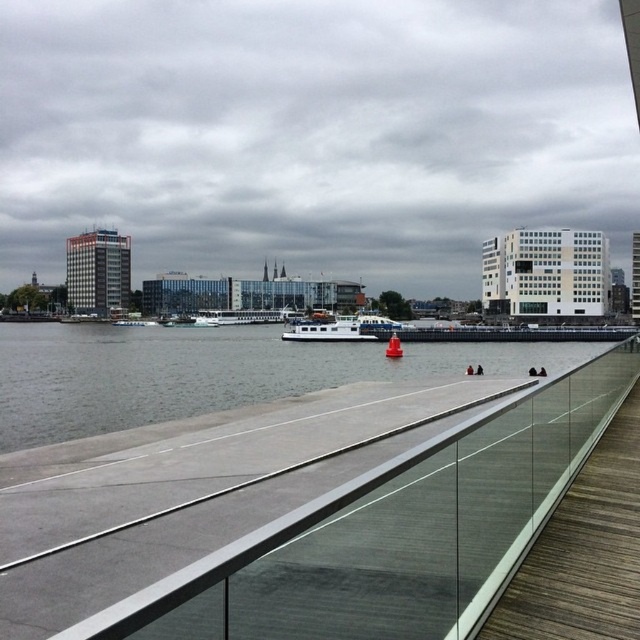
Looking at this image, you are standing on the walkway and want to take a photo of the gray concrete river at center and the white matte boat at center. Which object should you focus on first to ensure both are in sharp focus?

You should focus on the gray concrete river at center first because it is closer to you than the white matte boat at center, so adjusting focus from near to far will help both be in focus.

You are standing on the walkway and want to cross to the other side. The gray concrete river at center and the white matte boat at center are both in your path. Which one is shorter and can be stepped over?

The gray concrete river at center is shorter than the white matte boat at center, so you can step over the gray concrete river at center.